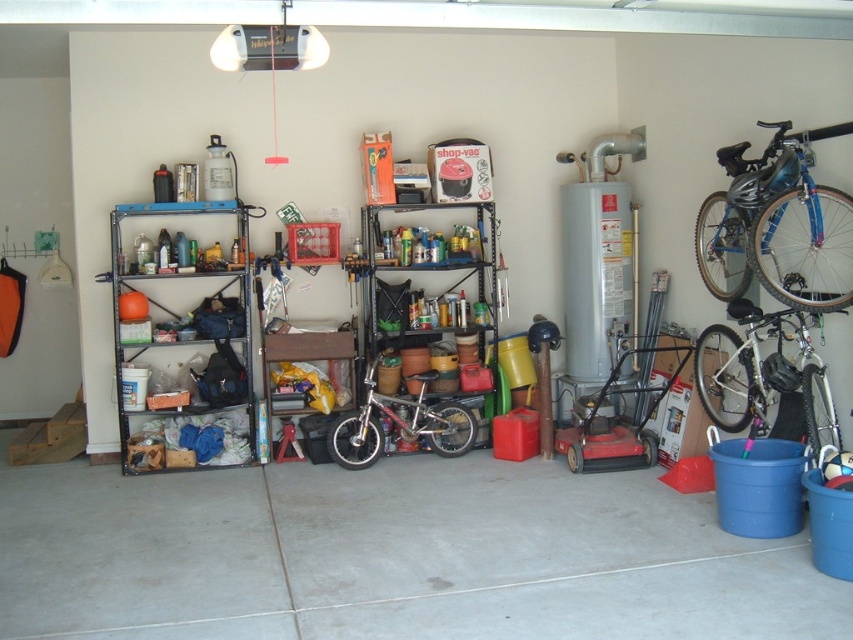
Does shiny silver bicycle at right have a greater width compared to wooden workbench at center?

No, shiny silver bicycle at right is not wider than wooden workbench at center.

Which of these two, shiny silver bicycle at right or wooden workbench at center, stands shorter?

Standing shorter between the two is wooden workbench at center.

Find the location of `shiny silver bicycle at right`. shiny silver bicycle at right is located at coordinates (763, 378).

Where is `shiny silver bicycle at right`? shiny silver bicycle at right is located at coordinates (763, 378).

Does metallic silver shelves at center have a lesser width compared to silver metallic bicycle at center?

Yes.

Does metallic silver shelves at center have a greater width compared to silver metallic bicycle at center?

No, metallic silver shelves at center is not wider than silver metallic bicycle at center.

Is point (393, 346) farther from viewer compared to point (439, 410)?

Yes, point (393, 346) is farther from viewer.

Where is `metallic silver shelves at center`? The image size is (853, 640). metallic silver shelves at center is located at coordinates (428, 298).

Does point (820, 358) come behind point (390, 420)?

No, (820, 358) is in front of (390, 420).

Describe the element at coordinates (763, 378) in the screenshot. I see `shiny silver bicycle at right` at that location.

Between point (732, 394) and point (415, 404), which one is positioned behind?

Positioned behind is point (415, 404).

The width and height of the screenshot is (853, 640). Find the location of `shiny silver bicycle at right`. shiny silver bicycle at right is located at coordinates (763, 378).